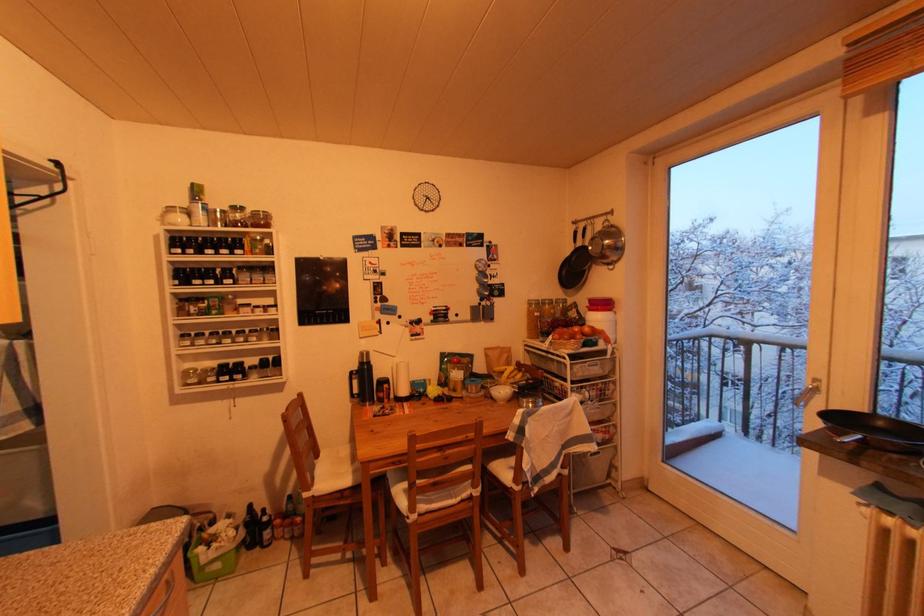
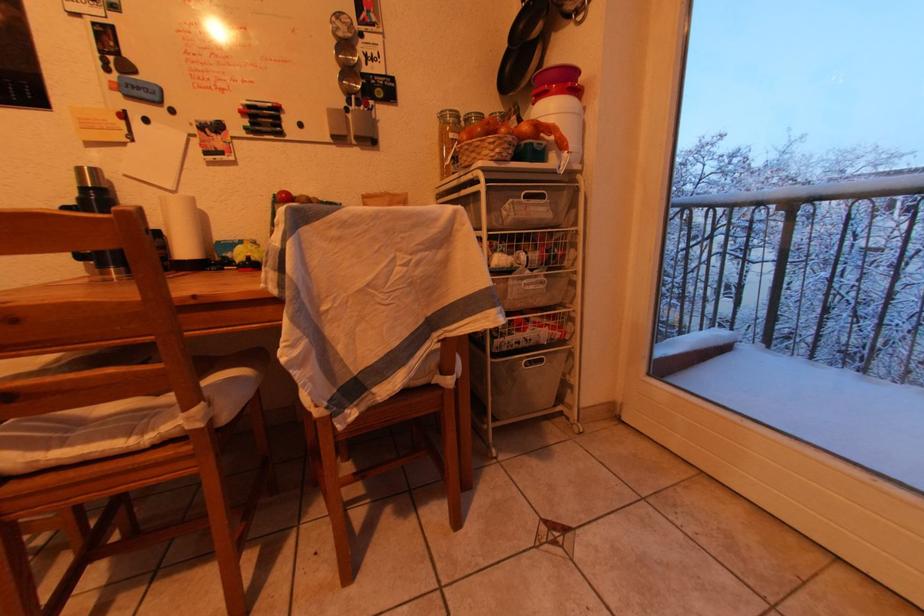
Which direction would the cameraman need to move to produce the second image?

The cameraman moved toward right, forward.